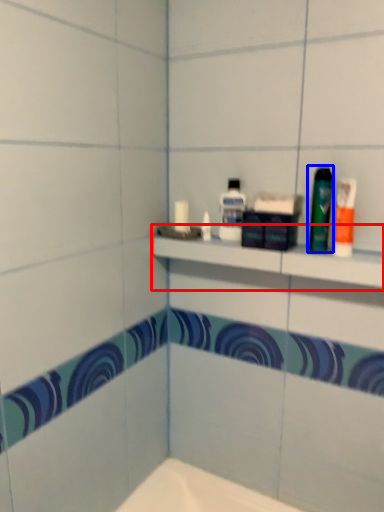
Question: Which object appears farthest to the camera in this image, shelf (highlighted by a red box) or mouthwash (highlighted by a blue box)?

Choices:
 (A) shelf
 (B) mouthwash

Answer: (B)